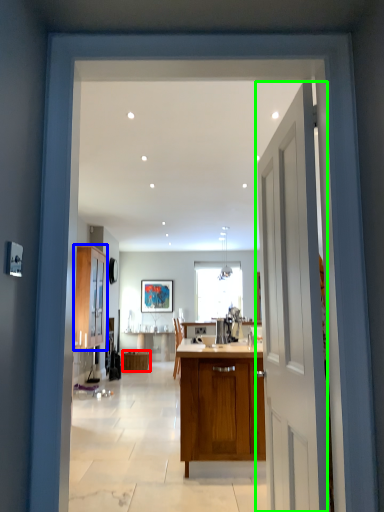
Question: Which object is the closest to the cabinetry (highlighted by a red box)? Choose among these: cabinetry (highlighted by a blue box) or door (highlighted by a green box).

Choices:
 (A) cabinetry
 (B) door

Answer: (A)